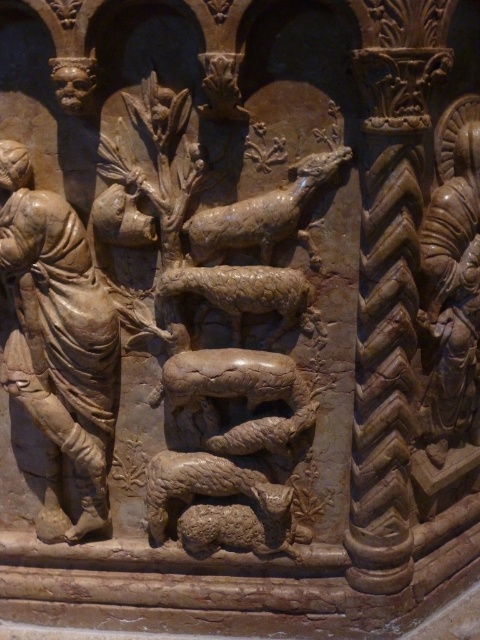
You are an art conservator assessing the dimensions of the stone figures in the carving. Which object has a greater width between the beige stone figure at left and the brown stone sheep at center?

The brown stone sheep at center has a greater width than the beige stone figure at left, as the beige stone figure at left is narrower.

You are an art conservator examining the stone carving. You need to determine which object is taller between the beige stone figure at left and the brown stone sheep at center. Based on the carving, which one is taller?

The beige stone figure at left is much taller than the brown stone sheep at center, so the beige stone figure at left is taller.